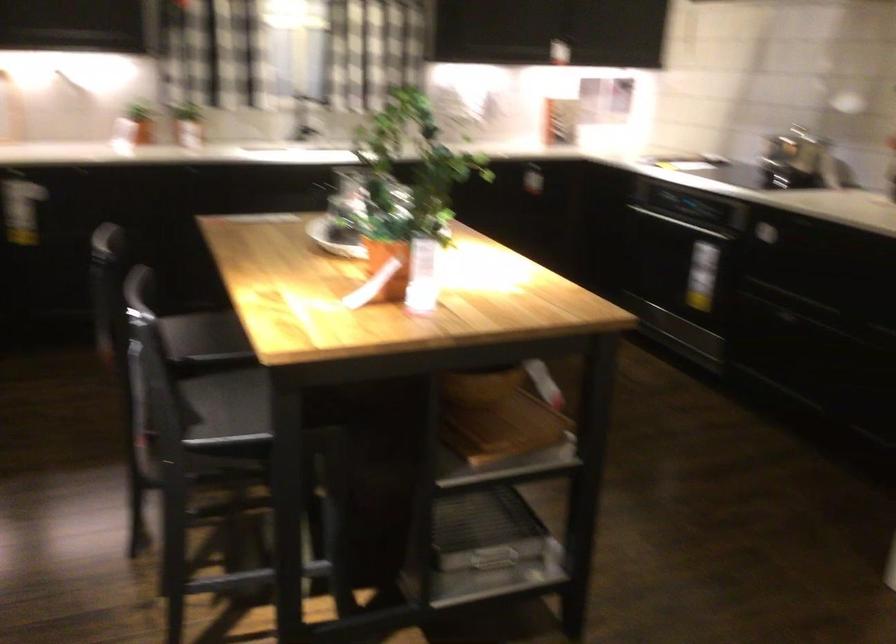
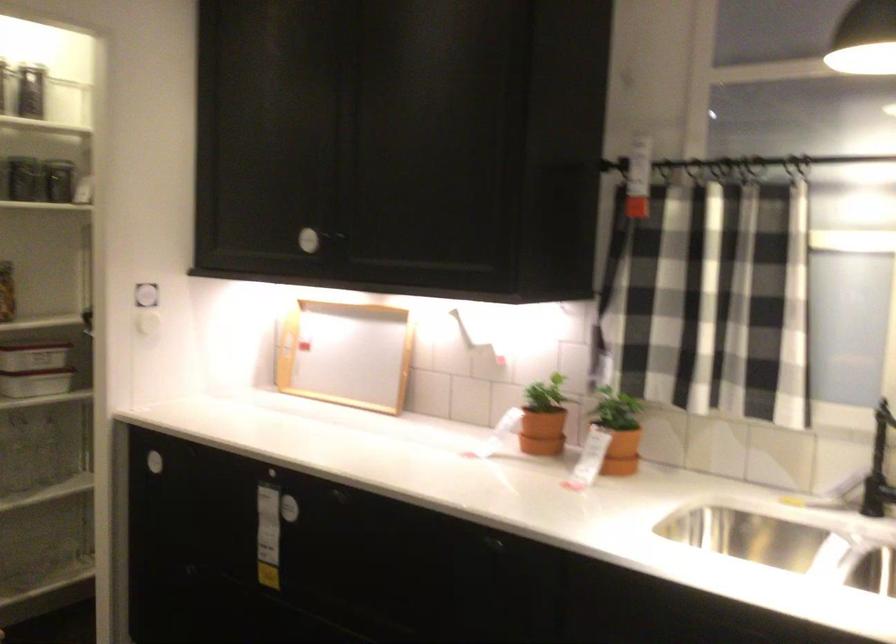
In the second image, find the point that corresponds to point (306, 118) in the first image.

(879, 468)